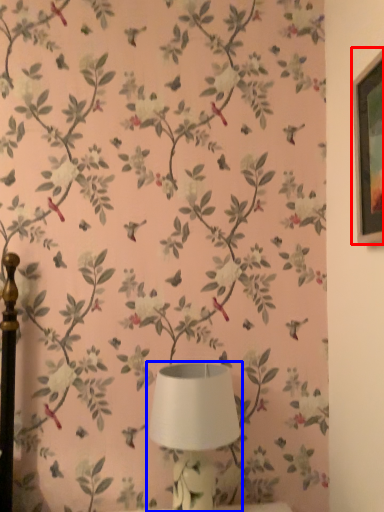
Question: Which point is closer to the camera, picture frame (highlighted by a red box) or lamp (highlighted by a blue box)?

Choices:
 (A) picture frame
 (B) lamp

Answer: (A)